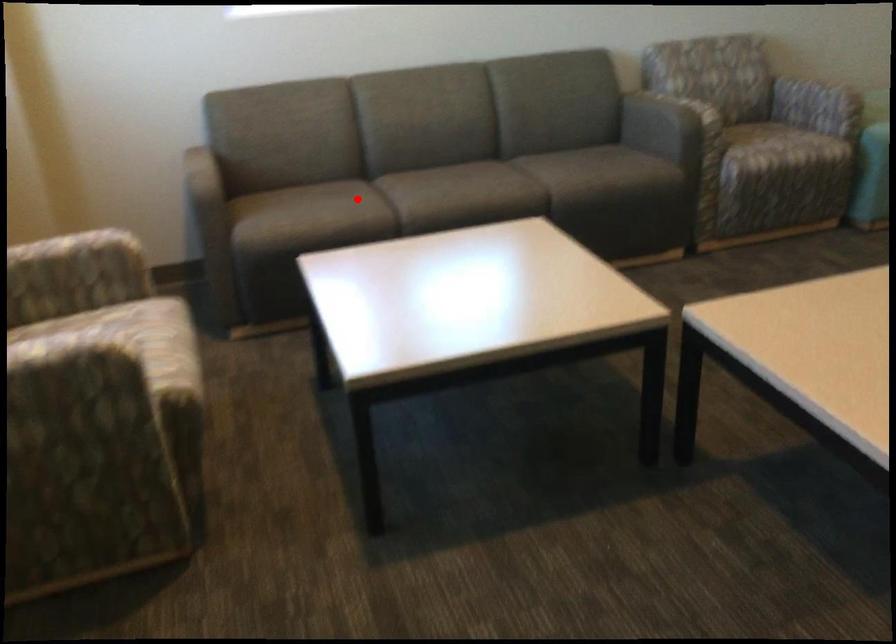
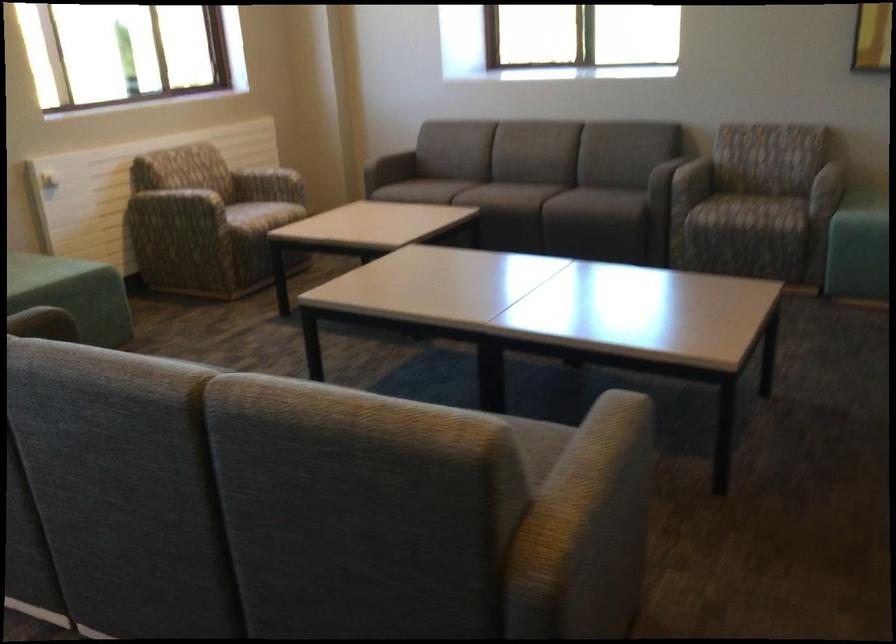
Question: I am providing you with two images of the same scene from different viewpoints. A red point is shown in image1. For the corresponding object point in image2, is it positioned nearer or farther from the camera?

Choices:
 (A) Nearer
 (B) Farther

Answer: (B)